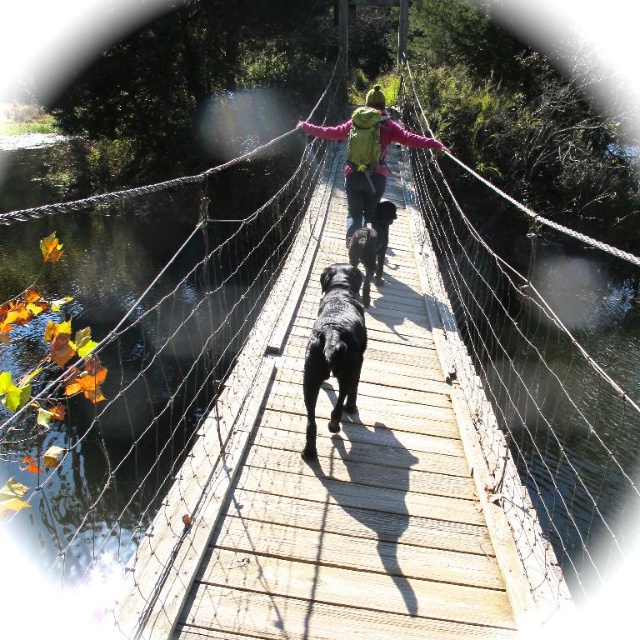
Question: Which object appears farthest from the camera in this image?

Choices:
 (A) black matte dog at center
 (B) shiny black dog at center

Answer: (A)

Question: Which object is positioned farthest from the green fabric backpack at center?

Choices:
 (A) shiny black dog at center
 (B) black matte dog at center

Answer: (A)

Question: In this image, where is shiny black dog at center located relative to green fabric backpack at center?

Choices:
 (A) above
 (B) below

Answer: (B)

Question: Does shiny black dog at center appear on the right side of green fabric backpack at center?

Choices:
 (A) yes
 (B) no

Answer: (B)

Question: Does shiny black dog at center have a lesser width compared to green fabric backpack at center?

Choices:
 (A) yes
 (B) no

Answer: (A)

Question: Which point is farther from the camera taking this photo?

Choices:
 (A) (369, 221)
 (B) (305, 397)
 (C) (365, 147)

Answer: (A)